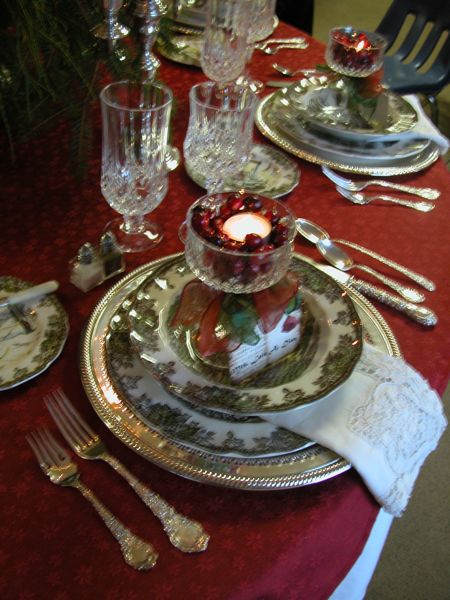
Locate an element on the screen. Image resolution: width=450 pixels, height=600 pixels. tablecloth is located at coordinates (253, 554).